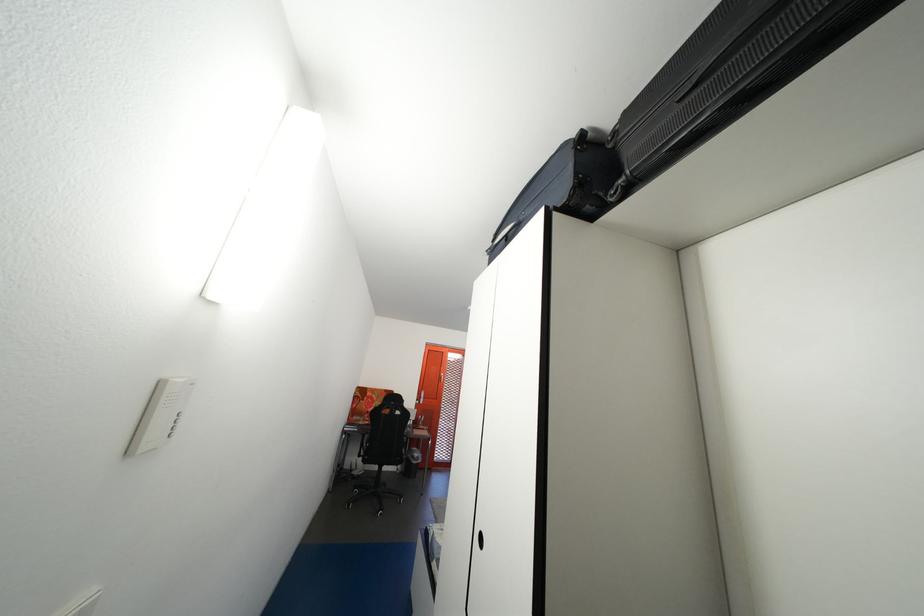
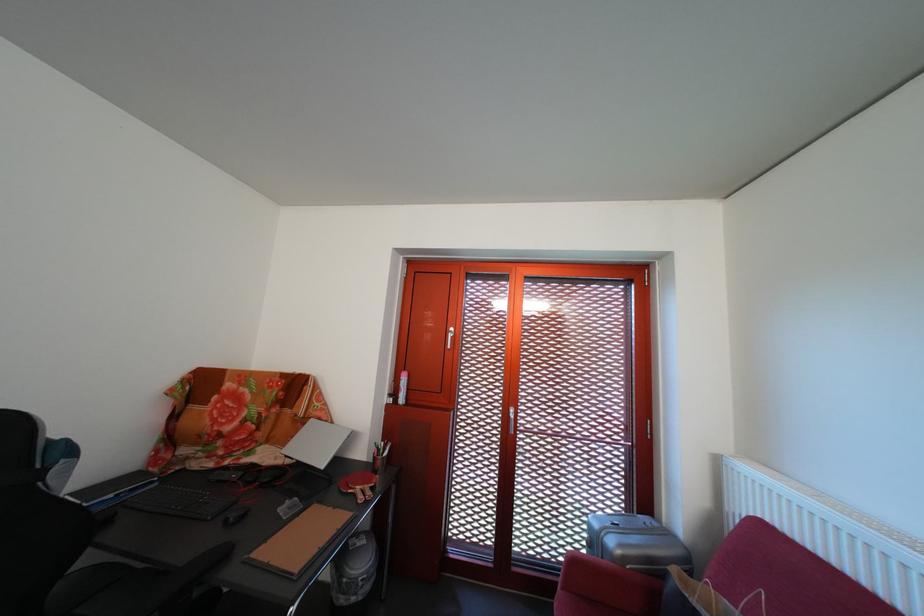
Question: Which direction would the cameraman need to move to produce the second image? Reply with the corresponding letter.

Choices:
 (A) Left
 (B) Right
 (C) Forward
 (D) Backward

Answer: (C)